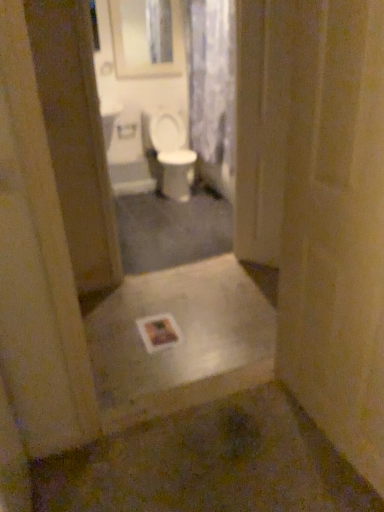
Question: In the image, is metallic silver step at center positioned in front of or behind transparent plastic screen door at center?

Choices:
 (A) behind
 (B) front

Answer: (B)

Question: Considering the positions of metallic silver step at center and transparent plastic screen door at center in the image, is metallic silver step at center wider or thinner than transparent plastic screen door at center?

Choices:
 (A) wide
 (B) thin

Answer: (A)

Question: Considering the real-world distances, which object is farthest from the translucent floral fabric at upper center?

Choices:
 (A) transparent plastic screen door at center
 (B) metallic silver step at center
 (C) smooth cream door at right
 (D) matte glass medicine cabinet at upper center
 (E) white matte toilet paper at center

Answer: (C)

Question: Which object is the farthest from the metallic silver step at center?

Choices:
 (A) white glossy toilet at center
 (B) matte glass medicine cabinet at upper center
 (C) translucent floral fabric at upper center
 (D) transparent plastic screen door at center
 (E) smooth cream door at right

Answer: (B)